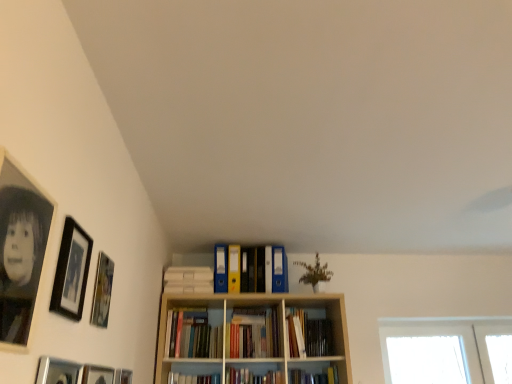
Question: Is green matte plant at upper center bigger or smaller than matte wooden picture frame at left, which ranks as the 5th picture frame in front-to-back order?

Choices:
 (A) big
 (B) small

Answer: (A)

Question: Does point (318, 281) appear closer or farther from the camera than point (113, 271)?

Choices:
 (A) farther
 (B) closer

Answer: (A)

Question: Based on their relative distances, which object is farther from the hardcover books at center, placed as the 2th book when sorted from top to bottom?

Choices:
 (A) metallic silver picture frame at lower left, arranged as the 2th picture frame when viewed from the front
 (B) green matte plant at upper center
 (C) matte plastic folders at center, the 3th book in the bottom-to-top sequence
 (D) matte black picture frame at lower left, the 3th picture frame positioned from the back
 (E) matte black picture frame at lower left, the sixth picture frame viewed from the front

Answer: (A)

Question: Estimate the real-world distances between objects in this image. Which object is closer to the hardcover books at center, placed as the 2th book when sorted from top to bottom?

Choices:
 (A) hardcover book at center, the third book from the top
 (B) green matte plant at upper center
 (C) matte black picture frame at lower left, the fourth picture frame when ordered from front to back
 (D) black matte picture frame at left, marked as the sixth picture frame in a back-to-front arrangement
 (E) matte plastic folders at center, the 3th book in the bottom-to-top sequence

Answer: (A)